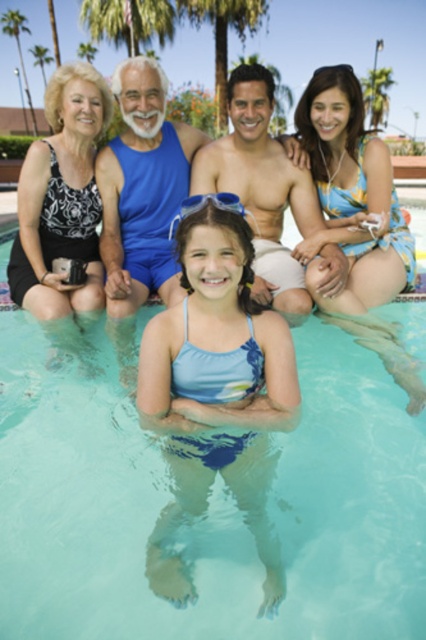
You are a photographer taking a picture of the scene. You want to ensure both the matte blue swimsuit at center and the green leafy palm tree at center are clearly visible. Which object should you focus on first to ensure it isn t cropped out of the frame?

The green leafy palm tree at center is taller than the matte blue swimsuit at center, so you should focus on the green leafy palm tree at center first to ensure it isn t cropped out of the frame.

You are a photographer taking a picture of the clear blue water at center and the green leafy palm tree at upper center. Which object will appear larger in the photo?

The clear blue water at center will appear larger in the photo because it is closer to the viewer than the green leafy palm tree at upper center.